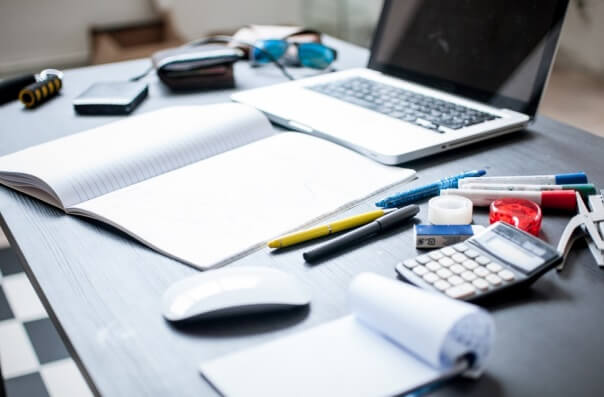
What are the coordinates of `office supplies` in the screenshot? It's located at (551, 177), (535, 186), (525, 195), (329, 229), (432, 241), (448, 214), (426, 187), (376, 223), (579, 226).